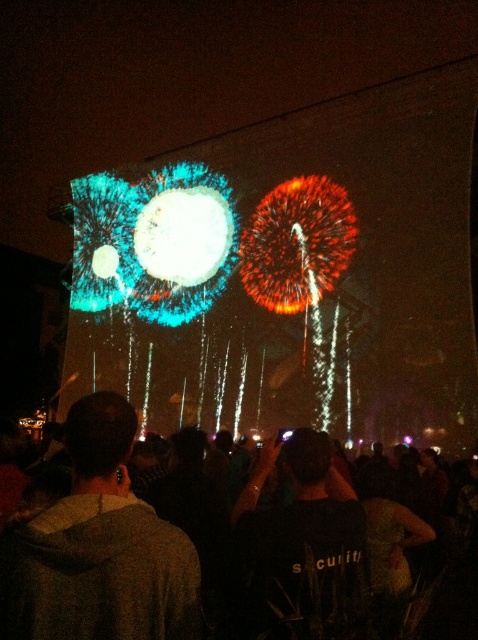
Question: Which point is closer to the camera taking this photo?

Choices:
 (A) (21, 616)
 (B) (52, 600)

Answer: (A)

Question: Which point is closer to the camera?

Choices:
 (A) (177, 572)
 (B) (125, 438)

Answer: (A)

Question: Does black fabric crowd at lower center appear over brown fabric at lower left?

Choices:
 (A) yes
 (B) no

Answer: (B)

Question: Is black fabric crowd at lower center bigger than brown fabric at lower left?

Choices:
 (A) yes
 (B) no

Answer: (A)

Question: Which object is closer to the camera taking this photo?

Choices:
 (A) black fabric crowd at lower center
 (B) brown fabric at lower left

Answer: (B)

Question: Does black fabric crowd at lower center have a larger size compared to brown fabric at lower left?

Choices:
 (A) no
 (B) yes

Answer: (B)